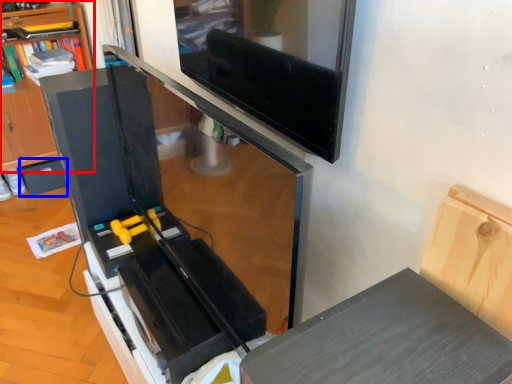
Question: Which of the following is the farthest to the observer, shelf (highlighted by a red box) or drawer (highlighted by a blue box)?

Choices:
 (A) shelf
 (B) drawer

Answer: (B)